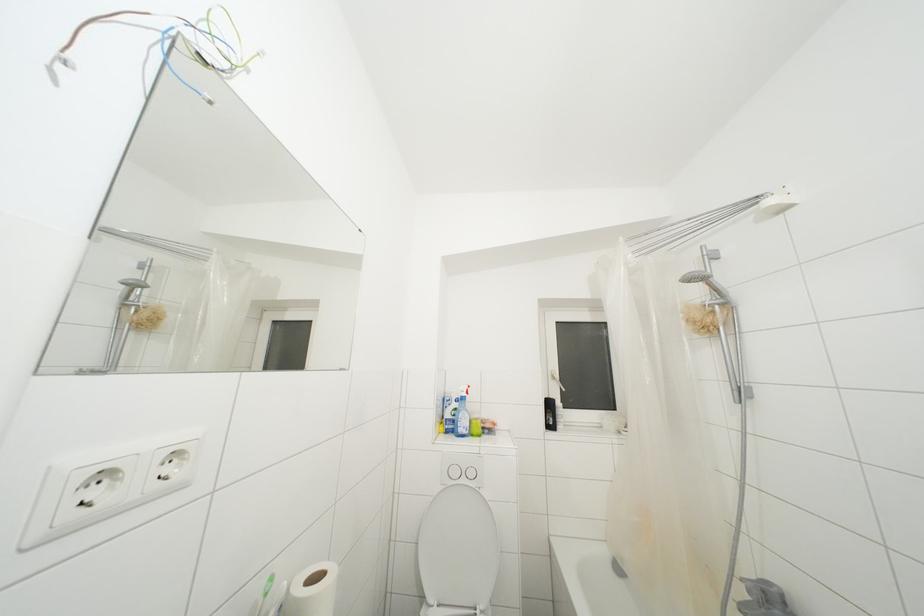
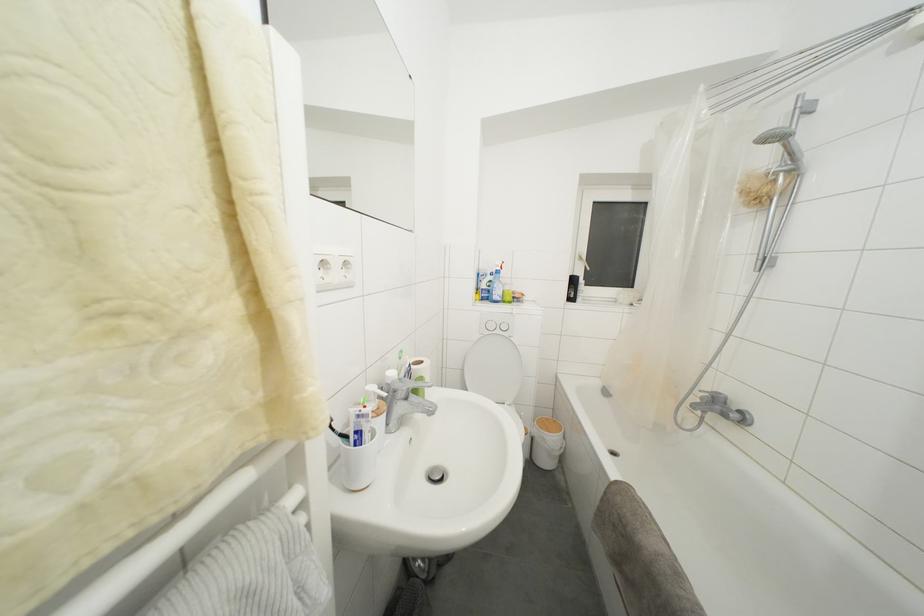
Where in the second image is the point corresponding to pixel 721 294 from the first image?

(796, 159)